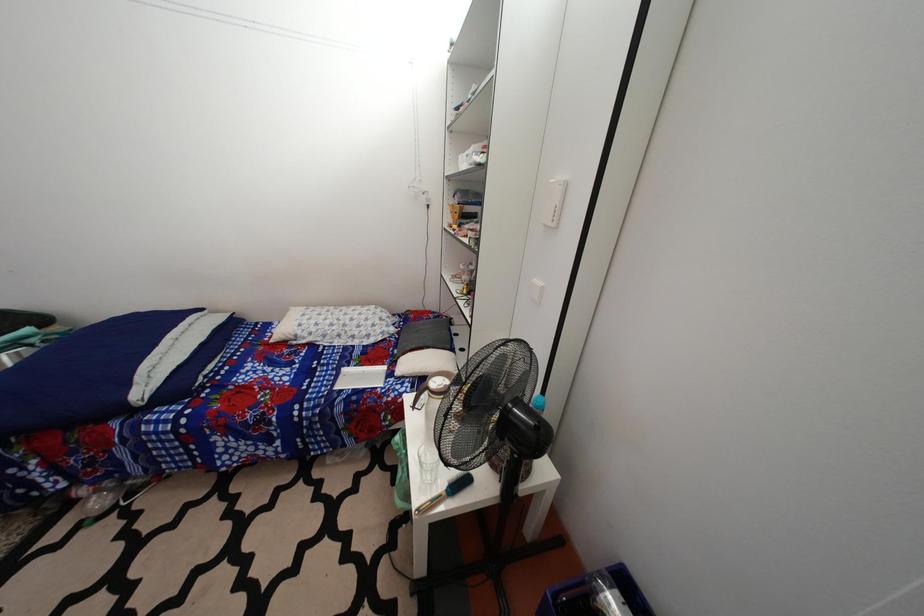
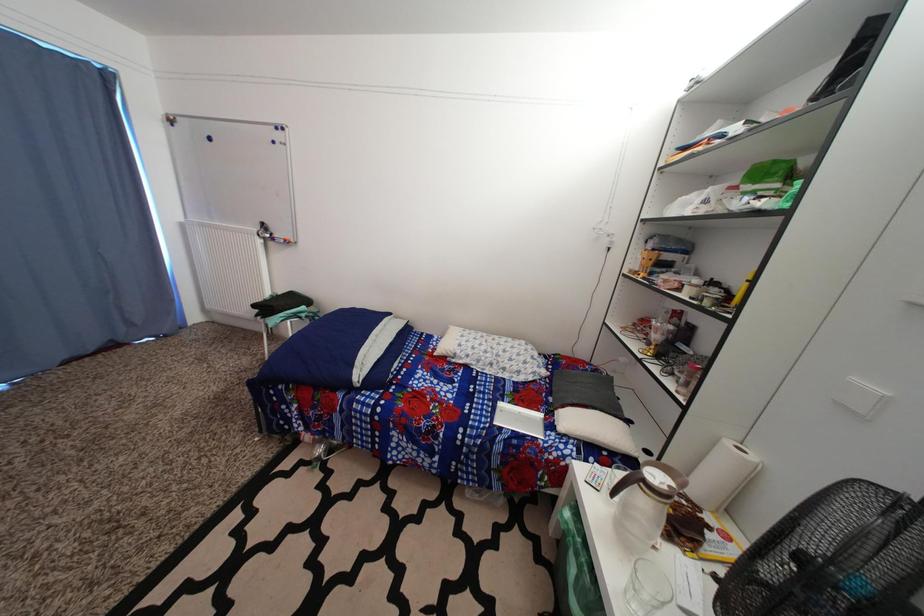
Question: In a continuous first-person perspective shot, in which direction is the camera moving?

Choices:
 (A) Left
 (B) Right
 (C) Forward
 (D) Backward

Answer: (A)